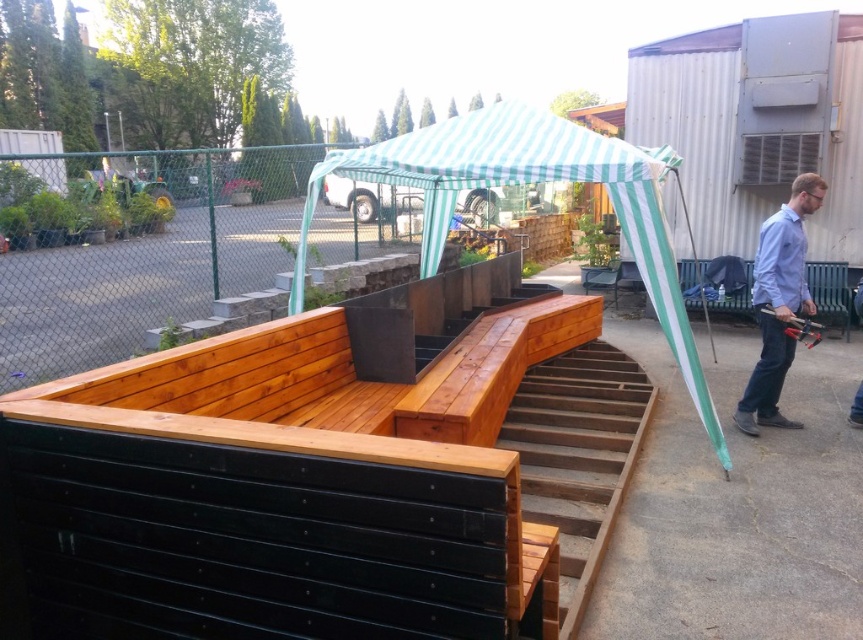
Question: Which object is positioned farthest from the green striped canopy at center?

Choices:
 (A) light blue shirt at right
 (B) wooden stairs at lower right

Answer: (A)

Question: Where is green striped canopy at center located in relation to light blue shirt at right in the image?

Choices:
 (A) above
 (B) below

Answer: (A)

Question: Is wooden stairs at lower right to the right of light blue shirt at right from the viewer's perspective?

Choices:
 (A) no
 (B) yes

Answer: (A)

Question: Can you confirm if wooden stairs at lower right is thinner than light blue shirt at right?

Choices:
 (A) no
 (B) yes

Answer: (A)

Question: Which is nearer to the wooden stairs at lower right?

Choices:
 (A) light blue shirt at right
 (B) green striped canopy at center

Answer: (A)

Question: Which point is closer to the camera taking this photo?

Choices:
 (A) (788, 305)
 (B) (448, 193)
 (C) (578, 618)

Answer: (C)